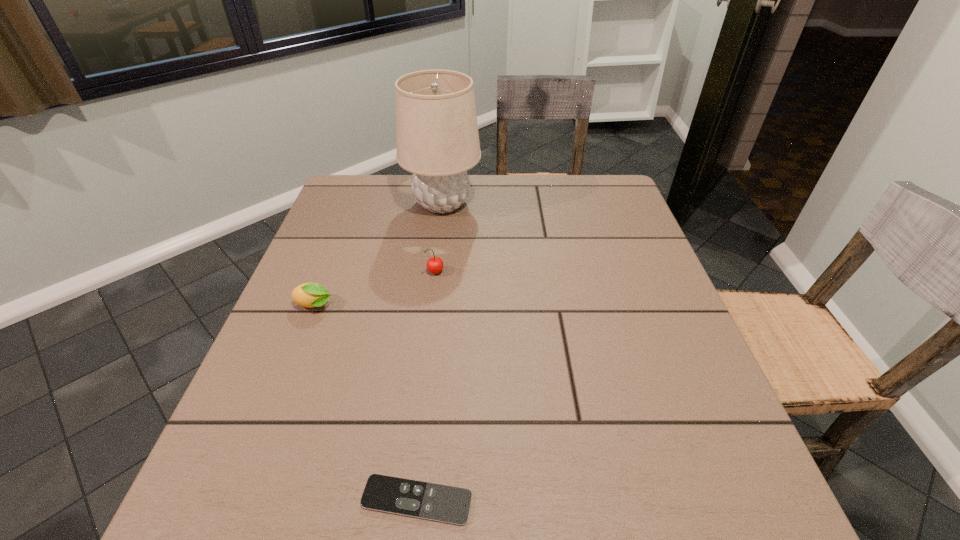
Where is `blank space located 0.270m with leaves positioned above the lemon`? blank space located 0.270m with leaves positioned above the lemon is located at coordinates (463, 306).

Where is `vacant space located 0.150m on the left of the nearest object`? vacant space located 0.150m on the left of the nearest object is located at coordinates (259, 500).

The height and width of the screenshot is (540, 960). I want to click on object at the far edge, so click(437, 139).

In order to click on object that is positioned at the near edge in this screenshot , I will do `click(442, 503)`.

Where is `object that is at the left edge`? object that is at the left edge is located at coordinates (310, 295).

In the image, there is a desktop. Where is `vacant space at the far edge`? The image size is (960, 540). vacant space at the far edge is located at coordinates (x=420, y=218).

What are the coordinates of `vacant space at the left edge of the desktop` in the screenshot? It's located at (332, 229).

In order to click on vacant space at the right edge of the desktop in this screenshot , I will do `click(639, 267)`.

Find the location of `free point at the far left corner`. free point at the far left corner is located at coordinates point(394,182).

In order to click on blank space at the near left corner of the desktop in this screenshot , I will do `click(211, 509)`.